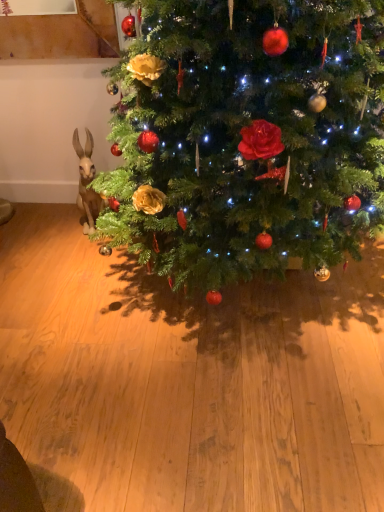
Describe the element at coordinates (248, 137) in the screenshot. Image resolution: width=384 pixels, height=512 pixels. I see `green matte christmas tree at center` at that location.

The height and width of the screenshot is (512, 384). Identify the location of green matte christmas tree at center. (248, 137).

What is the approximate width of green matte christmas tree at center?

The width of green matte christmas tree at center is 1.11 meters.

This screenshot has width=384, height=512. What do you see at coordinates (87, 182) in the screenshot? I see `matte plastic rabbit at left` at bounding box center [87, 182].

Image resolution: width=384 pixels, height=512 pixels. What are the coordinates of `matte plastic rabbit at left` in the screenshot? It's located at (87, 182).

In order to face matte plastic rabbit at left, should I rotate leftwards or rightwards?

You should look left and rotate roughly 13.716 degrees.

Image resolution: width=384 pixels, height=512 pixels. I want to click on green matte christmas tree at center, so click(248, 137).

Based on their positions, is matte plastic rabbit at left located to the left or right of green matte christmas tree at center?

Clearly, matte plastic rabbit at left is on the left of green matte christmas tree at center in the image.

Is matte plastic rabbit at left further to camera compared to green matte christmas tree at center?

Yes, it is behind green matte christmas tree at center.

Between point (88, 141) and point (374, 200), which one is positioned in front?

The point (374, 200) is in front.

From the image's perspective, is matte plastic rabbit at left located beneath green matte christmas tree at center?

Indeed, from the image's perspective, matte plastic rabbit at left is shown beneath green matte christmas tree at center.

In the scene shown: From a real-world perspective, is matte plastic rabbit at left above or below green matte christmas tree at center?

In terms of real-world spatial position, matte plastic rabbit at left is below green matte christmas tree at center.

Is matte plastic rabbit at left wider or thinner than green matte christmas tree at center?

Clearly, matte plastic rabbit at left has less width compared to green matte christmas tree at center.

Considering the sizes of matte plastic rabbit at left and green matte christmas tree at center in the image, is matte plastic rabbit at left taller or shorter than green matte christmas tree at center?

In the image, matte plastic rabbit at left appears to be shorter than green matte christmas tree at center.

Considering the sizes of matte plastic rabbit at left and green matte christmas tree at center in the image, is matte plastic rabbit at left bigger or smaller than green matte christmas tree at center?

matte plastic rabbit at left is smaller than green matte christmas tree at center.

Is matte plastic rabbit at left inside the boundaries of green matte christmas tree at center, or outside?

The correct answer is: outside.

Is matte plastic rabbit at left far away from green matte christmas tree at center?

They are positioned close to each other.

Is matte plastic rabbit at left aimed at green matte christmas tree at center?

Yes, matte plastic rabbit at left faces towards green matte christmas tree at center.

How many degrees apart are the facing directions of matte plastic rabbit at left and green matte christmas tree at center?

There is a 18.2-degree angle between the facing directions of matte plastic rabbit at left and green matte christmas tree at center.

Identify the location of animal on the left side of green matte christmas tree at center. (87, 182).

Considering the relative positions of green matte christmas tree at center and matte plastic rabbit at left in the image provided, is green matte christmas tree at center to the right of matte plastic rabbit at left from the viewer's perspective?

Yes.

Between green matte christmas tree at center and matte plastic rabbit at left, which one is positioned behind?

matte plastic rabbit at left is further from the camera.

Considering the points (266, 254) and (92, 164), which point is in front, point (266, 254) or point (92, 164)?

The point (266, 254) is in front.

From the image's perspective, is green matte christmas tree at center located above matte plastic rabbit at left?

Yes, from the image's perspective, green matte christmas tree at center is over matte plastic rabbit at left.

From a real-world perspective, is green matte christmas tree at center beneath matte plastic rabbit at left?

No.

Between green matte christmas tree at center and matte plastic rabbit at left, which one has larger width?

green matte christmas tree at center.

Between green matte christmas tree at center and matte plastic rabbit at left, which one has more height?

green matte christmas tree at center is taller.

Is green matte christmas tree at center smaller than matte plastic rabbit at left?

No, green matte christmas tree at center is not smaller than matte plastic rabbit at left.

Looking at this image, is green matte christmas tree at center located outside matte plastic rabbit at left?

Yes, green matte christmas tree at center is outside of matte plastic rabbit at left.

Are green matte christmas tree at center and matte plastic rabbit at left far apart?

They are positioned close to each other.

Based on the photo, could you tell me if green matte christmas tree at center is turned towards matte plastic rabbit at left?

No, green matte christmas tree at center is not turned towards matte plastic rabbit at left.

How different are the orientations of green matte christmas tree at center and matte plastic rabbit at left in degrees?

The angular difference between green matte christmas tree at center and matte plastic rabbit at left is 18.2 degrees.

Identify the location of christmas tree that is in front of the matte plastic rabbit at left. (248, 137).

The width and height of the screenshot is (384, 512). I want to click on animal below the green matte christmas tree at center (from a real-world perspective), so click(x=87, y=182).

Find the location of `animal on the left of green matte christmas tree at center`. animal on the left of green matte christmas tree at center is located at coordinates (87, 182).